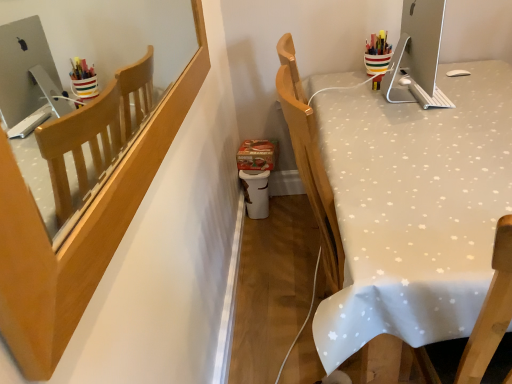
Question: Can you confirm if satin silver monitor at upper right is smaller than wooden chair back at upper left?

Choices:
 (A) yes
 (B) no

Answer: (B)

Question: Is satin silver monitor at upper right located outside wooden chair back at upper left?

Choices:
 (A) no
 (B) yes

Answer: (B)

Question: From a real-world perspective, is satin silver monitor at upper right positioned under wooden chair back at upper left based on gravity?

Choices:
 (A) no
 (B) yes

Answer: (B)

Question: Is satin silver monitor at upper right to the left of wooden chair back at upper left from the viewer's perspective?

Choices:
 (A) no
 (B) yes

Answer: (A)

Question: From a real-world perspective, is satin silver monitor at upper right located higher than wooden chair back at upper left?

Choices:
 (A) yes
 (B) no

Answer: (B)

Question: Choose the correct answer: Is white fabric-covered desk at right inside satin silver monitor at upper right or outside it?

Choices:
 (A) inside
 (B) outside

Answer: (B)

Question: Is white fabric-covered desk at right wider or thinner than satin silver monitor at upper right?

Choices:
 (A) wide
 (B) thin

Answer: (A)

Question: From a real-world perspective, is white fabric-covered desk at right above or below satin silver monitor at upper right?

Choices:
 (A) above
 (B) below

Answer: (B)

Question: Is white fabric-covered desk at right in front of or behind satin silver monitor at upper right in the image?

Choices:
 (A) front
 (B) behind

Answer: (A)

Question: Is wooden chair back at upper left inside the boundaries of satin silver monitor at upper right, or outside?

Choices:
 (A) inside
 (B) outside

Answer: (B)

Question: Is wooden chair back at upper left bigger or smaller than satin silver monitor at upper right?

Choices:
 (A) big
 (B) small

Answer: (B)

Question: Would you say wooden chair back at upper left is to the left or to the right of satin silver monitor at upper right in the picture?

Choices:
 (A) right
 (B) left

Answer: (B)

Question: From their relative heights in the image, would you say wooden chair back at upper left is taller or shorter than satin silver monitor at upper right?

Choices:
 (A) tall
 (B) short

Answer: (B)

Question: Considering the positions of satin silver monitor at upper right and wooden chair back at upper left in the image, is satin silver monitor at upper right taller or shorter than wooden chair back at upper left?

Choices:
 (A) short
 (B) tall

Answer: (B)

Question: Considering the positions of satin silver monitor at upper right and wooden chair back at upper left in the image, is satin silver monitor at upper right wider or thinner than wooden chair back at upper left?

Choices:
 (A) wide
 (B) thin

Answer: (A)